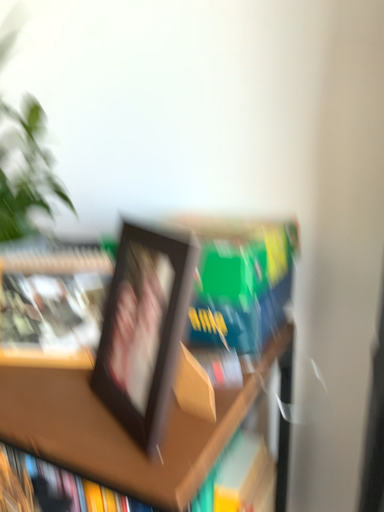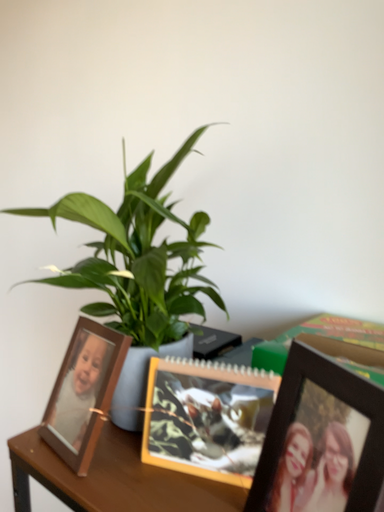
Question: How did the camera likely rotate when shooting the video?

Choices:
 (A) rotated right
 (B) rotated left

Answer: (B)